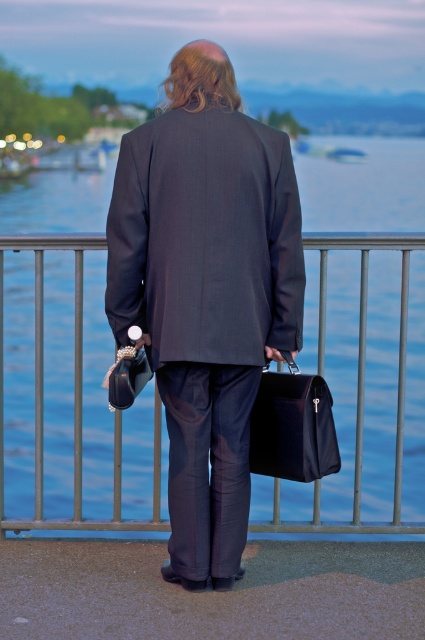
You are a security guard tasked with ensuring that all items are kept within a 20 inch radius of each other for easy monitoring. You notice the matte black briefcase at center and the leather textured handbag at lower center. Are these two items within the required distance?

The distance between the matte black briefcase at center and the leather textured handbag at lower center is 19.35 inches, which is within the 20 inch radius requirement. Therefore, the items are properly positioned for monitoring.

You are the person in the image holding the black briefcase and the dark bag with a pearl detail. You want to place both items on the railing so that they are as close as possible to the blue water at center without falling off. Where should you position them?

The blue water at center is located at point [68,371], so you should place the items on the railing near that coordinate to be as close as possible without falling off.